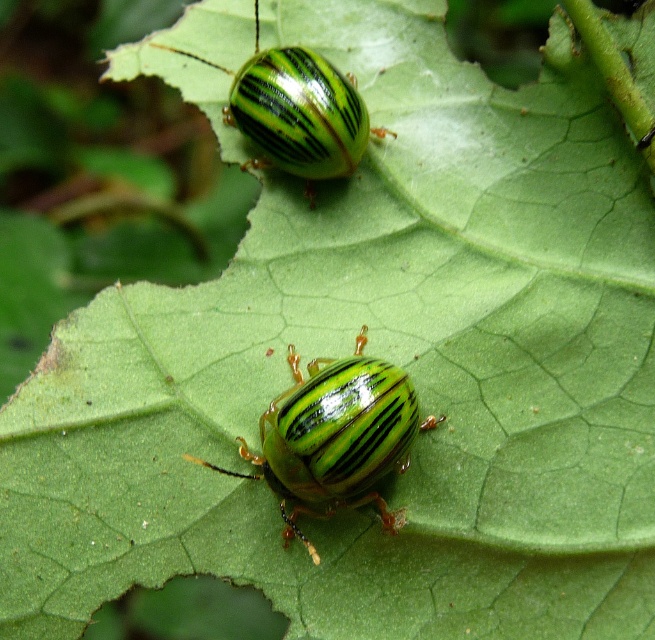
What do you see at coordinates (335, 436) in the screenshot? This screenshot has height=640, width=655. I see `green glossy beetle at center` at bounding box center [335, 436].

Between green glossy beetle at center and green glossy beetle at upper center, which one appears on the right side from the viewer's perspective?

green glossy beetle at center is more to the right.

Does point (400, 380) lie in front of point (238, 128)?

Yes, it is.

The width and height of the screenshot is (655, 640). What are the coordinates of `green glossy beetle at center` in the screenshot? It's located at (335, 436).